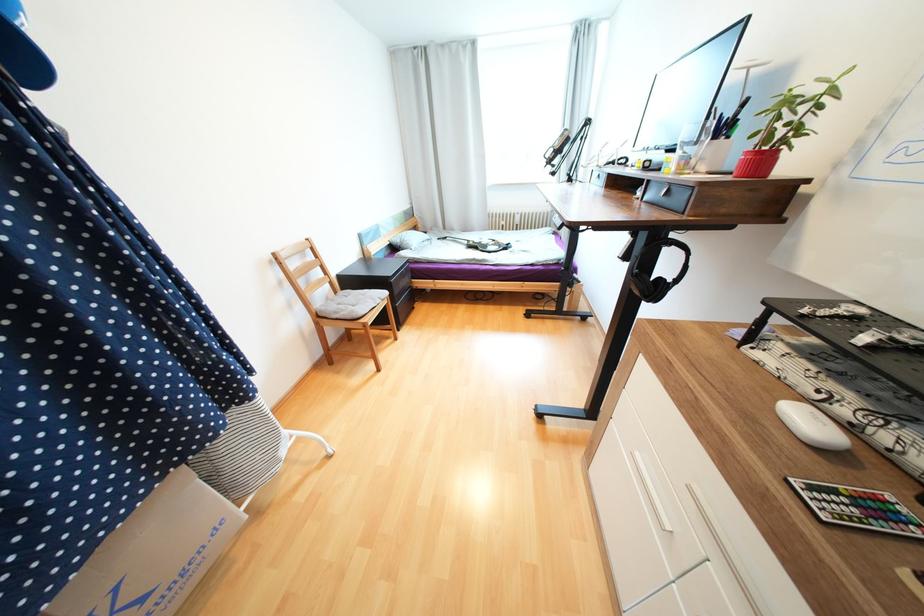
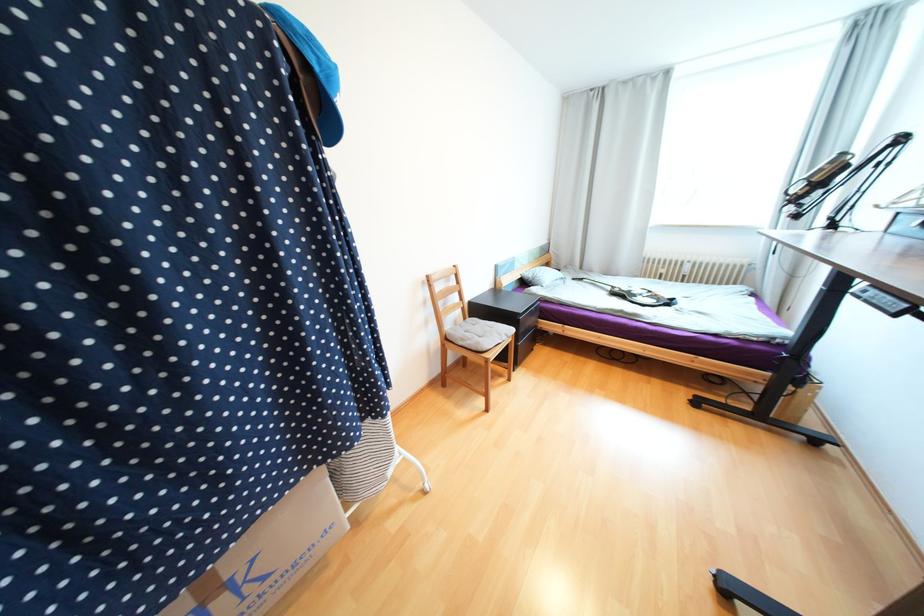
In the second image, find the point that corresponds to pixel 169 476 in the first image.

(314, 471)